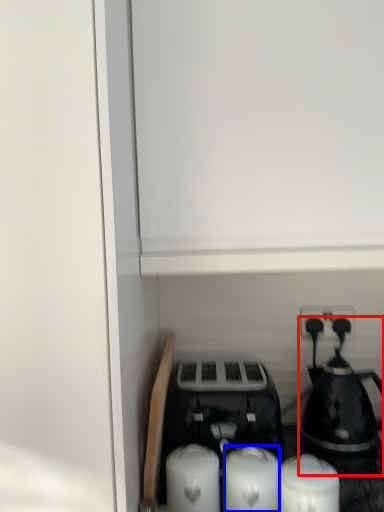
Question: Which of the following is the farthest to the observer, coffee maker (highlighted by a red box) or candle (highlighted by a blue box)?

Choices:
 (A) coffee maker
 (B) candle

Answer: (A)